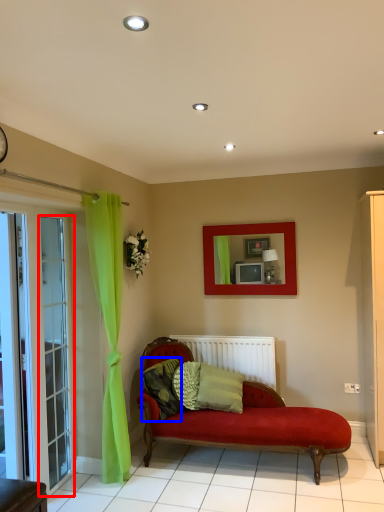
Question: Which object appears closest to the camera in this image, glass door (highlighted by a red box) or pillow (highlighted by a blue box)?

Choices:
 (A) glass door
 (B) pillow

Answer: (A)